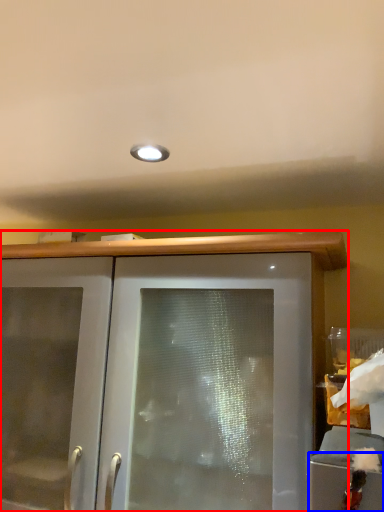
Question: Which object is closer to the camera taking this photo, cabinetry (highlighted by a red box) or cabinetry (highlighted by a blue box)?

Choices:
 (A) cabinetry
 (B) cabinetry

Answer: (B)